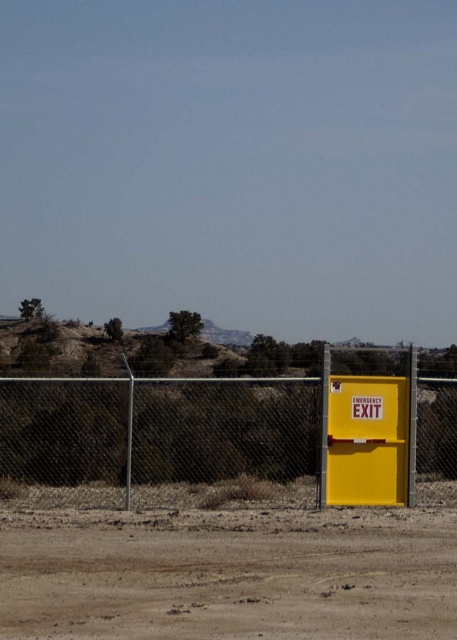
You are standing in front of the emergency exit door within the chain link fence. You see two points marked on the ground, point (418,512) and point (44,384). Which point is closer to you?

Point (418,512) is closer to the viewer than point (44,384).

You are standing at point (234, 432) and want to walk towards the bright yellow emergency exit door within a chainlink fence. Is the metallic chainlink fence at right blocking your path?

The metallic chainlink fence at right is located at point (234, 432), so yes, it is blocking your path towards the bright yellow emergency exit door within a chainlink fence.

You are a delivery robot with a width of 1 meter. You need to navigate from your current position to the yellow matte emergency exit sign at right. The only path available is the dull brown dirt track at lower center. Can you pass through the track without getting stuck?

The dull brown dirt track at lower center might be wider than the yellow matte emergency exit sign at right, but since the robot is 1 meter wide, it is uncertain if the track is wide enough. The robot should check the track width before proceeding.